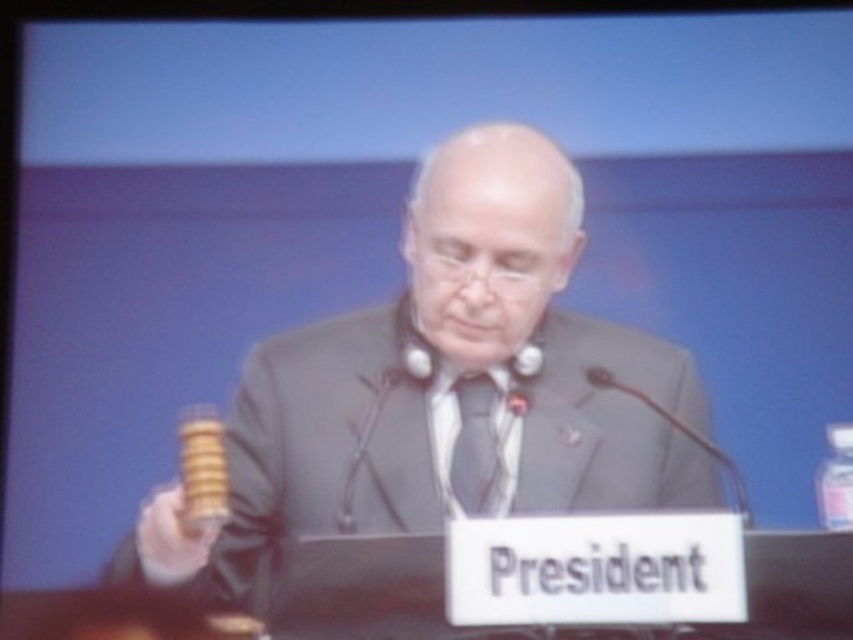
Question: Is gray suit at center below matte gray tie at center?

Choices:
 (A) no
 (B) yes

Answer: (B)

Question: Is gray suit at center further to the viewer compared to matte gray tie at center?

Choices:
 (A) no
 (B) yes

Answer: (A)

Question: Which point is farther to the camera?

Choices:
 (A) matte gray tie at center
 (B) gray suit at center

Answer: (A)

Question: Which of the following is the closest to the observer?

Choices:
 (A) (645, 484)
 (B) (463, 378)

Answer: (A)

Question: Does gray suit at center have a larger size compared to matte gray tie at center?

Choices:
 (A) yes
 (B) no

Answer: (A)